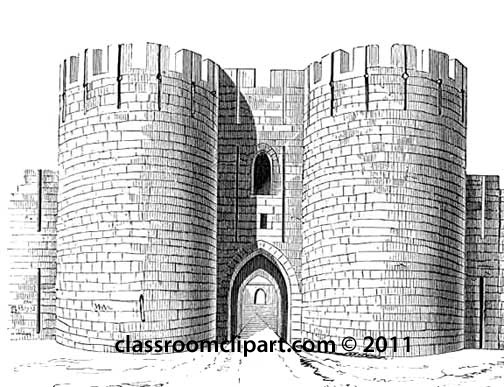
This screenshot has width=504, height=387. Find the location of `window`. window is located at coordinates (258, 178).